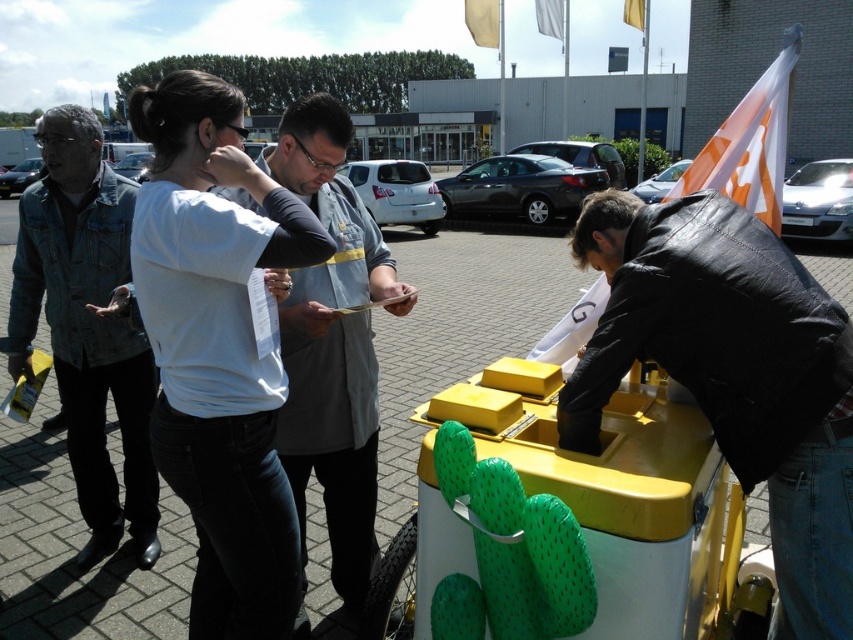
Consider the image. You are standing at the center of the image and want to place a new object at the same location as the yellow plastic street vendor at right. What are the coordinates where you should place it?

The coordinates for the yellow plastic street vendor at right are at point (732, 372).

You are a delivery person trying to place a package on the yellow plastic street vendor at right and the denim jacket at left. Which object can you place the package on without it falling off?

The yellow plastic street vendor at right is bigger than the denim jacket at left, so you can place the package on the yellow plastic street vendor at right without it falling off.